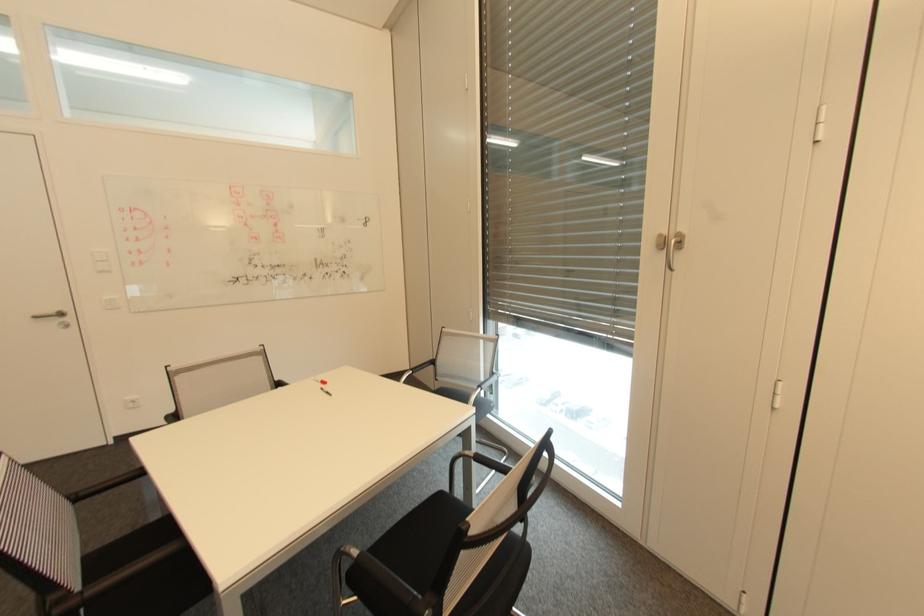
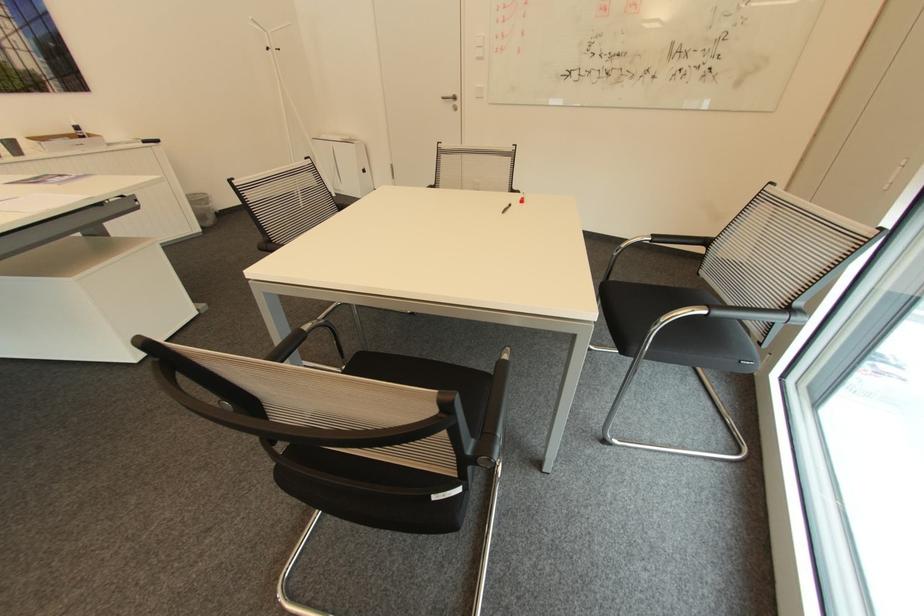
The point at (56,310) is marked in the first image. Where is the corresponding point in the second image?

(456, 95)